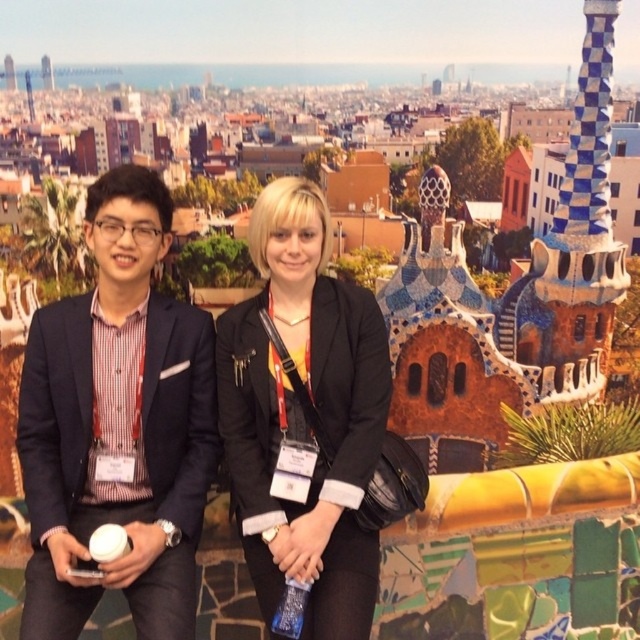
Is matte black blazer at left bigger than black matte jacket at center?

Incorrect, matte black blazer at left is not larger than black matte jacket at center.

Does matte black blazer at left appear over black matte jacket at center?

Yes.

What do you see at coordinates (116, 426) in the screenshot? This screenshot has height=640, width=640. I see `matte black blazer at left` at bounding box center [116, 426].

Where is `matte black blazer at left`? The height and width of the screenshot is (640, 640). matte black blazer at left is located at coordinates (116, 426).